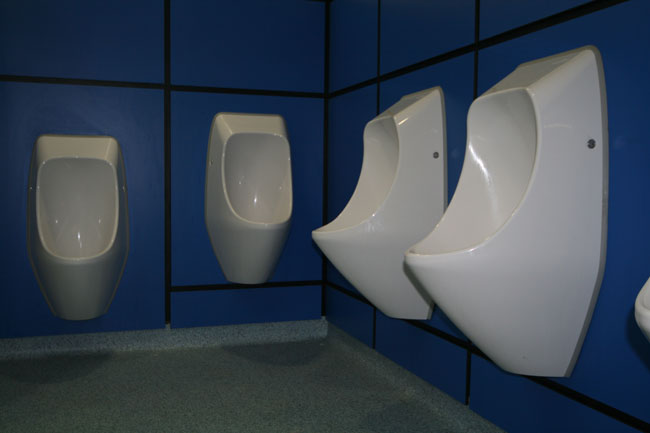
Where is `urinal`? The height and width of the screenshot is (433, 650). urinal is located at coordinates (643, 300), (452, 241), (366, 197), (248, 181), (73, 200).